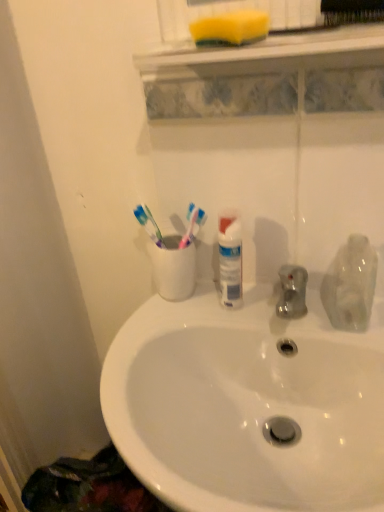
This screenshot has height=512, width=384. I want to click on free area below yellow sponge at upper center (from a real-world perspective), so click(x=270, y=306).